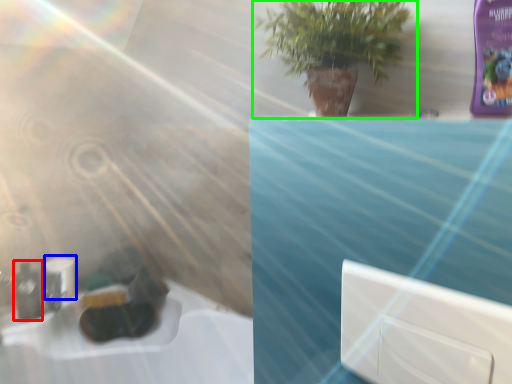
Question: Which is farther away from mouthwash (highlighted by a red box)? toilet paper (highlighted by a blue box) or houseplant (highlighted by a green box)?

Choices:
 (A) toilet paper
 (B) houseplant

Answer: (B)